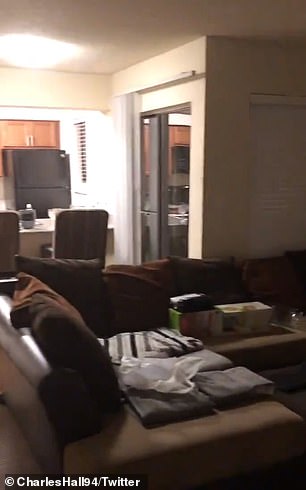
The image size is (306, 490). In order to click on brown sofa in this screenshot , I will do `click(264, 358)`.